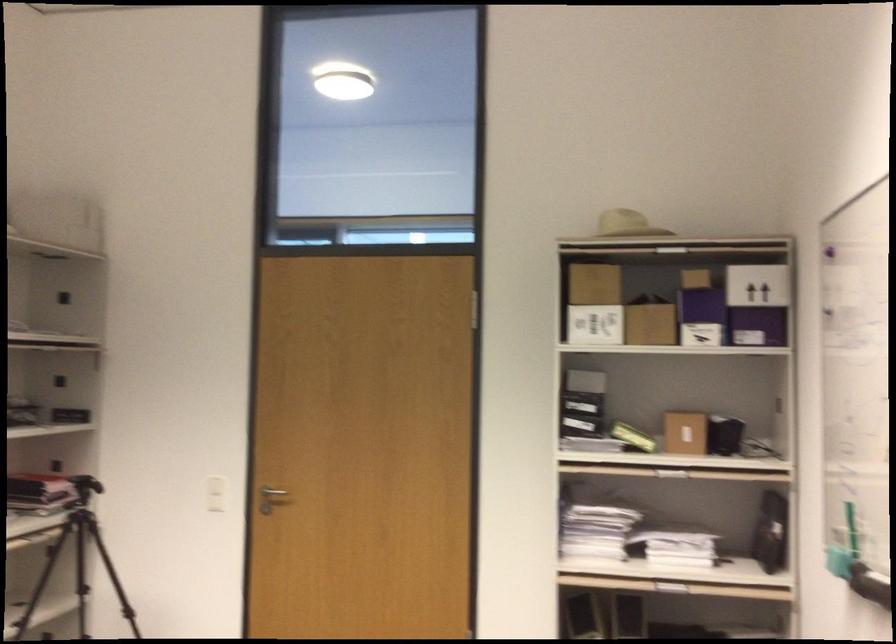
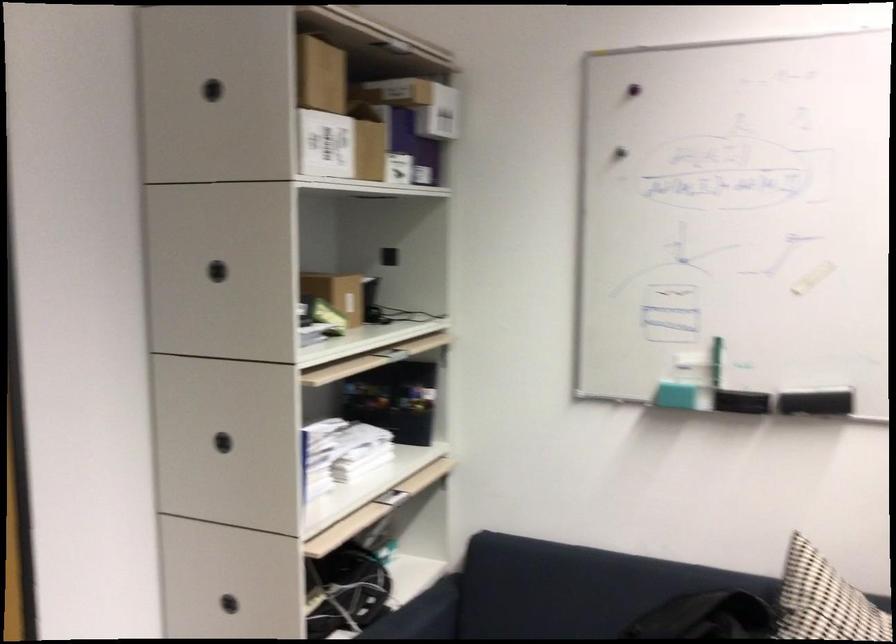
Where in the second image is the point corresponding to (x=727, y=332) from the first image?

(398, 167)